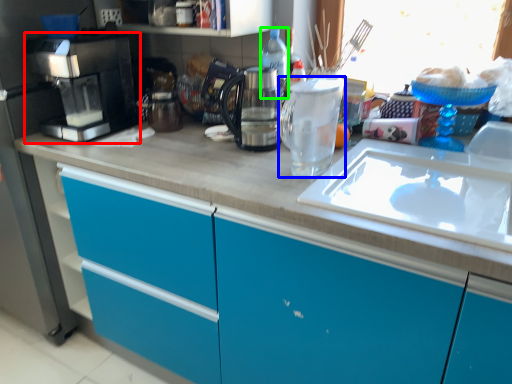
Question: Considering the real-world distances, which object is closest to home appliance (highlighted by a red box)? kitchen appliance (highlighted by a blue box) or bottle (highlighted by a green box).

Choices:
 (A) kitchen appliance
 (B) bottle

Answer: (B)